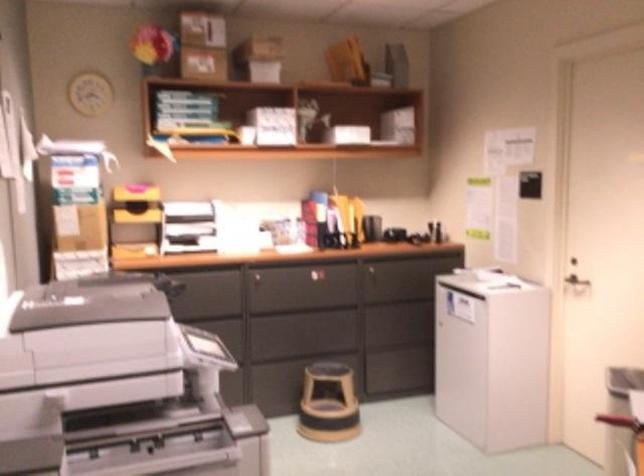
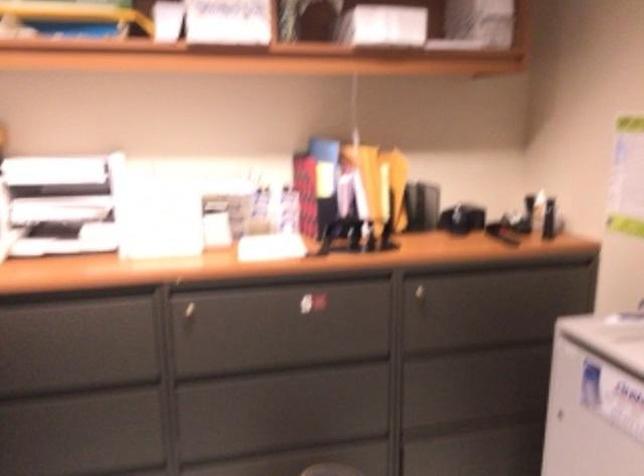
Where in the second image is the point corresponding to the point at 254,279 from the first image?

(185, 307)